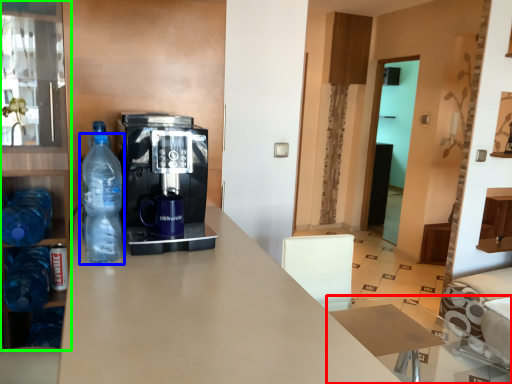
Question: Which object is positioned farthest from table (highlighted by a red box)? Select from bottle (highlighted by a blue box) and cabinetry (highlighted by a green box).

Choices:
 (A) bottle
 (B) cabinetry

Answer: (B)